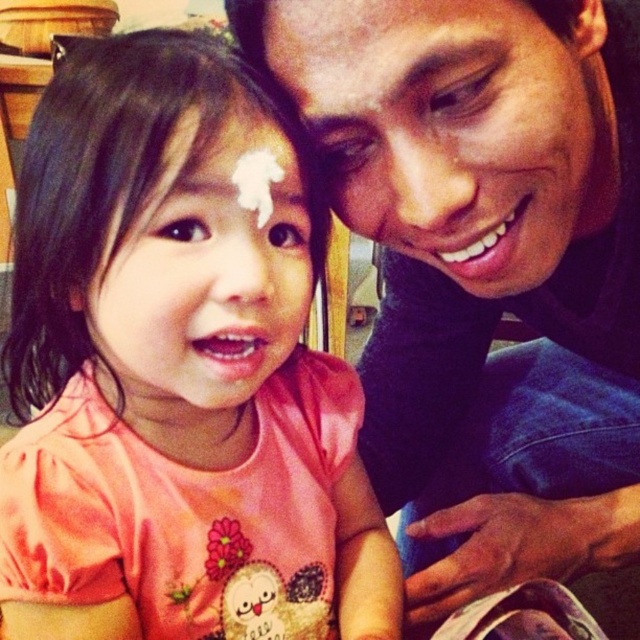
You are a baker who needs to place a decorative sugar icing on a cake. The cake has a matte blue shirt at upper right. Can you fit the white sugar icing at center between them without overlapping?

The matte blue shirt at upper right is 13.96 inches away from the white sugar icing at center, so there is sufficient space to place the white sugar icing at center between them without overlapping.

You are a photographer trying to capture a close up of the point at coordinates point (442, 3). The camera has a focal length of 50mm and a sensor size of 24mm. What is the minimum distance you need to be from the subject to ensure the point is in focus?

The point at coordinates point (442, 3) is 15.61 inches from the camera. To ensure it is in focus, you need to be at least 15.61 inches away from the subject.